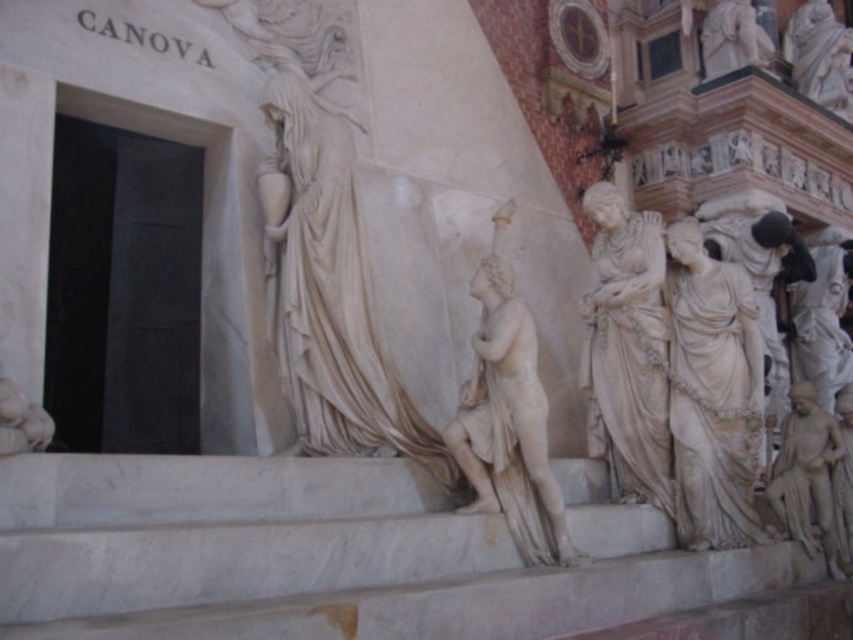
Is white marble draped cloth at right below white marble statue at right?

Incorrect, white marble draped cloth at right is not positioned below white marble statue at right.

Does white marble draped cloth at right have a lesser height compared to white marble statue at right?

No.

Find the location of a particular element. white marble draped cloth at right is located at coordinates (712, 394).

Where is `white marble draped cloth at right`? The width and height of the screenshot is (853, 640). white marble draped cloth at right is located at coordinates (712, 394).

Is the position of white marble statue at center more distant than that of white marble statue at upper right?

No.

Consider the image. Is white marble statue at center closer to the viewer compared to white marble statue at upper right?

Yes, white marble statue at center is in front of white marble statue at upper right.

Does point (497, 324) lie in front of point (838, 58)?

Yes, it is in front of point (838, 58).

Locate an element on the screen. The image size is (853, 640). white marble statue at center is located at coordinates (508, 419).

Is white marble draped cloth at right wider than white marble statue at center?

No.

Does white marble draped cloth at right appear under white marble statue at center?

Yes, white marble draped cloth at right is below white marble statue at center.

Does point (686, 524) come closer to viewer compared to point (563, 518)?

No, it is behind (563, 518).

Where is `white marble draped cloth at right`? This screenshot has width=853, height=640. white marble draped cloth at right is located at coordinates (712, 394).